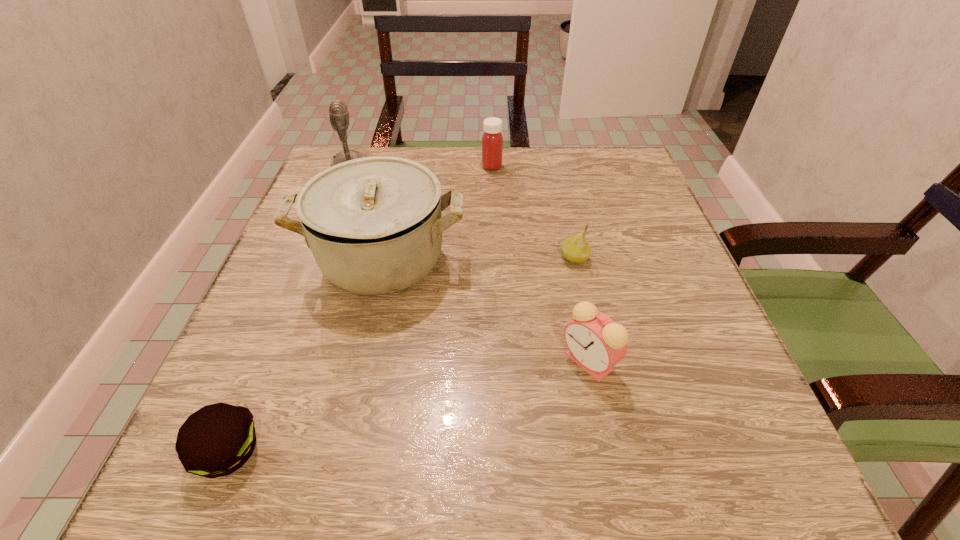
The height and width of the screenshot is (540, 960). I want to click on vacant space situated 0.190m on the face of the fifth farthest object, so click(x=441, y=362).

Find the location of a particular element. The width and height of the screenshot is (960, 540). free space located on the face of the fifth farthest object is located at coordinates (415, 362).

The height and width of the screenshot is (540, 960). Identify the location of vacant region located 0.270m on the face of the fifth farthest object. (390, 362).

In order to click on vacant region located 0.290m on the front of the pear in this screenshot , I will do 607,406.

Identify the location of vacant space located 0.150m on the right of the patty. pyautogui.click(x=374, y=452).

Identify the location of microphone situated at the far edge. (338, 111).

Locate an element on the screen. The height and width of the screenshot is (540, 960). medicine located in the far edge section of the desktop is located at coordinates (492, 141).

You are a GUI agent. You are given a task and a screenshot of the screen. Output one action in this format:
    pyautogui.click(x=<x>, y=<y>)
    Task: Click on the object that is at the near edge
    Image resolution: width=960 pixels, height=540 pixels.
    Given the screenshot: What is the action you would take?
    pyautogui.click(x=218, y=439)

At what (x,y) coordinates should I click in order to perform the action: click on microphone present at the left edge. Please return your answer as a coordinate pair (x, y). Looking at the image, I should click on (338, 111).

Find the location of a particular element. Image resolution: width=960 pixels, height=540 pixels. saucepan that is positioned at the left edge is located at coordinates (374, 225).